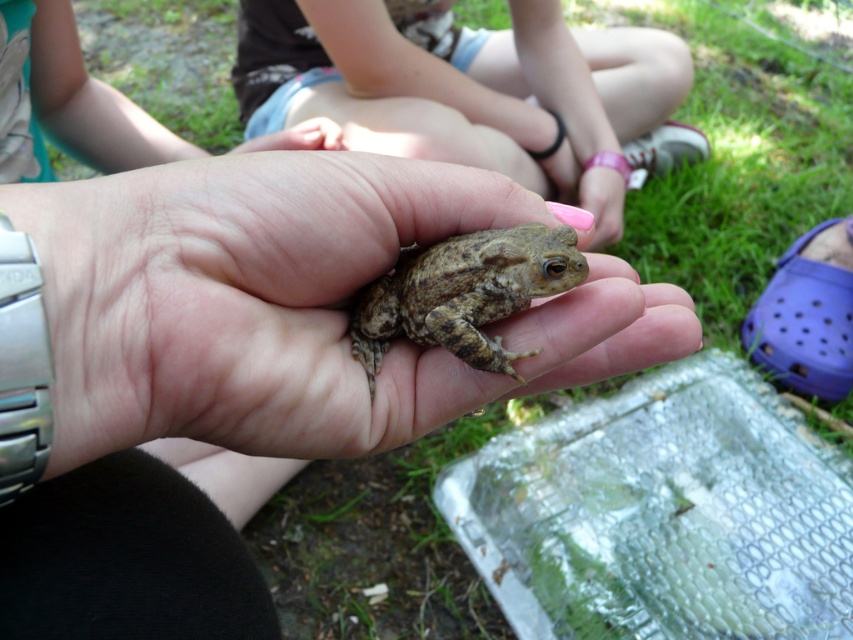
Does smooth skin frog at center appear on the left side of brown textured frog at center?

In fact, smooth skin frog at center is to the right of brown textured frog at center.

Is smooth skin frog at center shorter than brown textured frog at center?

Incorrect, smooth skin frog at center's height does not fall short of brown textured frog at center's.

Does point (497, 148) come closer to viewer compared to point (508, 280)?

No.

The height and width of the screenshot is (640, 853). Find the location of `smooth skin frog at center`. smooth skin frog at center is located at coordinates (473, 90).